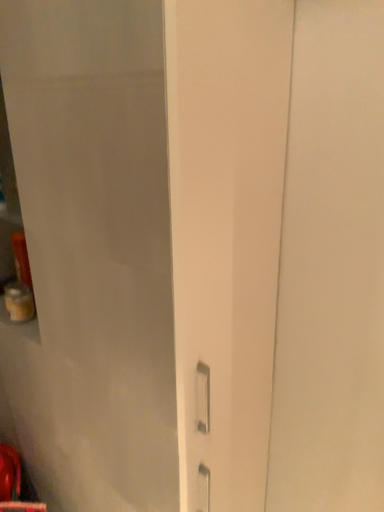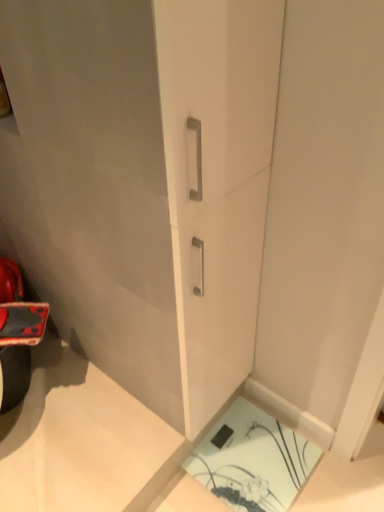
Question: Which way did the camera rotate in the video?

Choices:
 (A) rotated downward
 (B) rotated upward

Answer: (A)